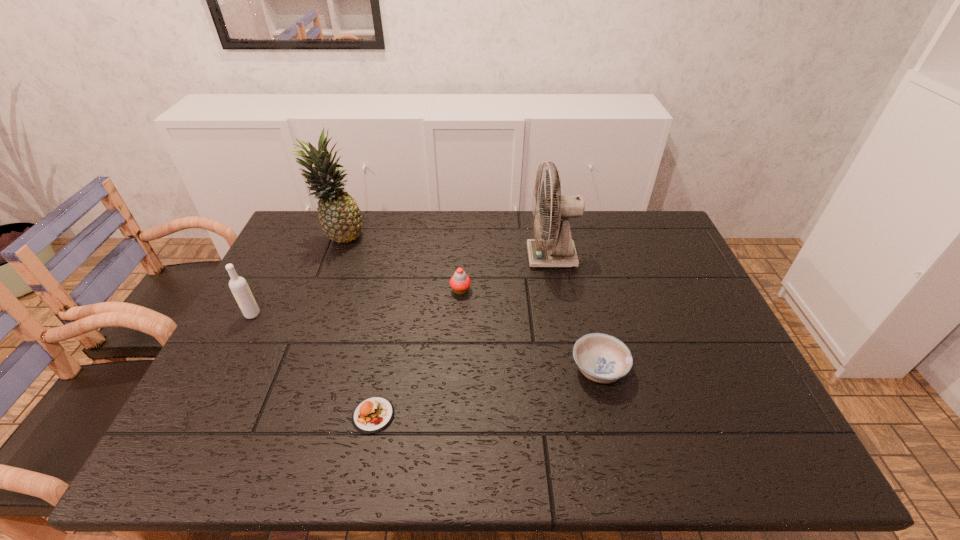
This screenshot has width=960, height=540. I want to click on pineapple, so click(339, 215).

You are a GUI agent. You are given a task and a screenshot of the screen. Output one action in this format:
    pyautogui.click(x=<x>, y=<y>)
    Task: Click on the second tallest object
    
    Given the screenshot: What is the action you would take?
    pyautogui.click(x=560, y=251)

In order to click on the third nearest object in this screenshot , I will do `click(238, 285)`.

Locate an element on the screen. The width and height of the screenshot is (960, 540). the fourth shortest object is located at coordinates (238, 285).

Where is `the fourth tallest object`? the fourth tallest object is located at coordinates (460, 282).

Where is `the third object from right to left`? This screenshot has height=540, width=960. the third object from right to left is located at coordinates (460, 282).

The width and height of the screenshot is (960, 540). I want to click on bowl, so click(602, 358).

At what (x,y) coordinates should I click in order to perform the action: click on the second shortest object. Please return your answer as a coordinate pair (x, y). Looking at the image, I should click on (602, 358).

Identify the location of the third object from left to right. Image resolution: width=960 pixels, height=540 pixels. (373, 414).

Locate an element on the screen. This screenshot has height=540, width=960. the nearest object is located at coordinates [x=373, y=414].